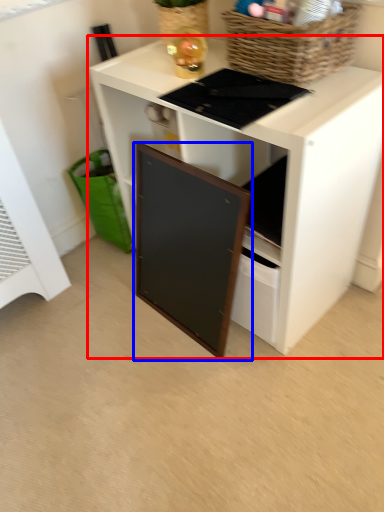
Question: Which object appears closest to the camera in this image, desk (highlighted by a red box) or cabinetry (highlighted by a blue box)?

Choices:
 (A) desk
 (B) cabinetry

Answer: (A)